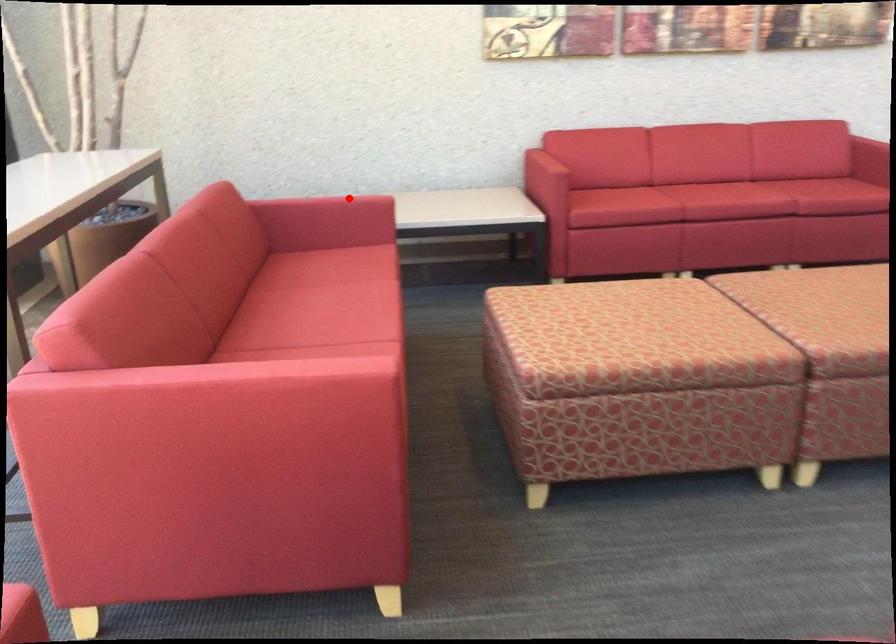
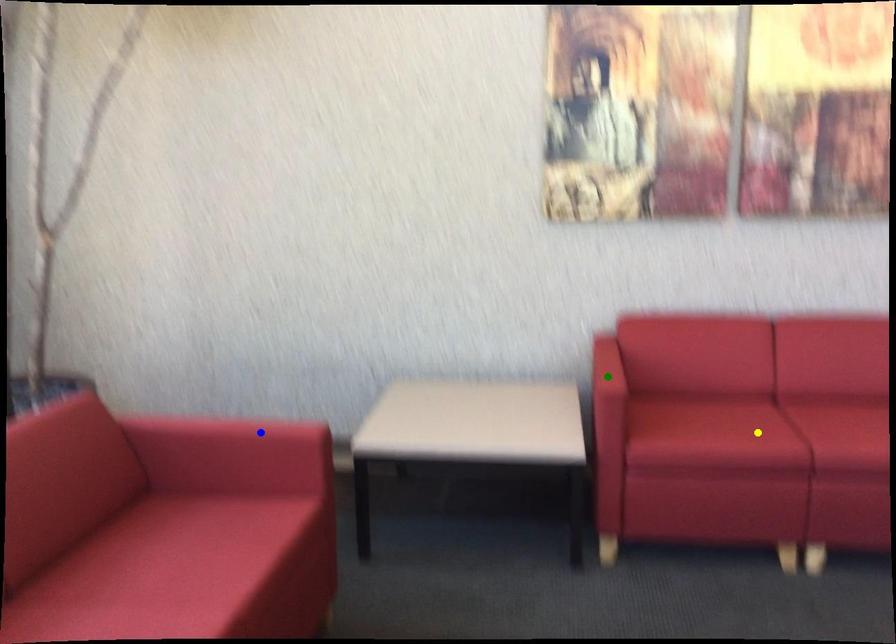
Question: I am providing you with two images of the same scene from different viewpoints. A red point is marked on the first image. You are given multiple points on the second image. Which spot in image 2 lines up with the point in image 1?

Choices:
 (A) yellow point
 (B) blue point
 (C) green point

Answer: (B)